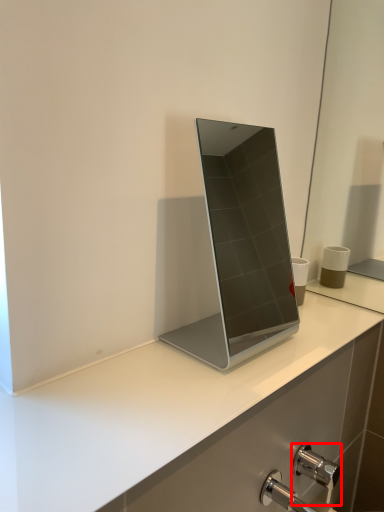
Question: From the image, what is the correct spatial relationship of tap (annotated by the red box) in relation to laptop?

Choices:
 (A) left
 (B) right

Answer: (B)